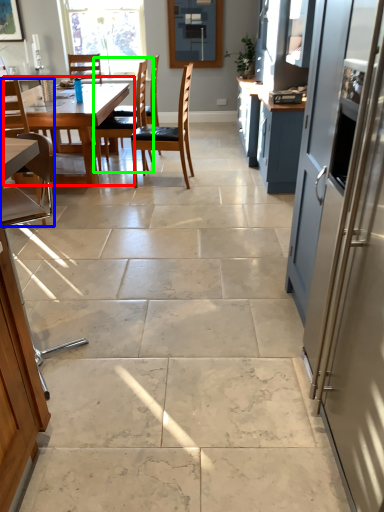
Question: Based on their relative distances, which object is nearer to kitchen & dining room table (highlighted by a red box)? Choose from chair (highlighted by a blue box) and chair (highlighted by a green box).

Choices:
 (A) chair
 (B) chair

Answer: (A)